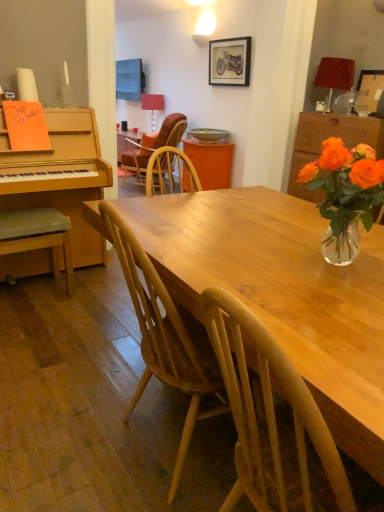
Question: In terms of height, does light brown wooden table at center look taller or shorter compared to translucent glass vase at upper right, the first cabinetry when ordered from right to left?

Choices:
 (A) short
 (B) tall

Answer: (B)

Question: Is light brown wooden table at center wider or thinner than translucent glass vase at upper right, the second cabinetry when ordered from left to right?

Choices:
 (A) wide
 (B) thin

Answer: (A)

Question: Estimate the real-world distances between objects in this image. Which object is farther from the wooden picture frame at upper right, arranged as the 2th picture frame when viewed from the left?

Choices:
 (A) wooden textured chair at center, which appears as the second chair when ordered from the bottom
 (B) matte red lampshade at upper right, the first lamp when ordered from bottom to top
 (C) wooden picture frame at upper center, the first picture frame viewed from the top
 (D) light brown wooden table at center
 (E) orange wood cabinet at center, which is counted as the 1th cabinetry, starting from the back

Answer: (D)

Question: Which of these objects is positioned farthest from the wooden picture frame at upper right, which is counted as the second picture frame, starting from the top?

Choices:
 (A) matte red lampshade at upper right, which appears as the 2th lamp when viewed from the back
 (B) light brown wooden table at center
 (C) wooden textured chair at center, which ranks as the first chair in top-to-bottom order
 (D) translucent glass vase at upper right
 (E) wooden picture frame at upper center, which is counted as the 1th picture frame, starting from the left

Answer: (D)